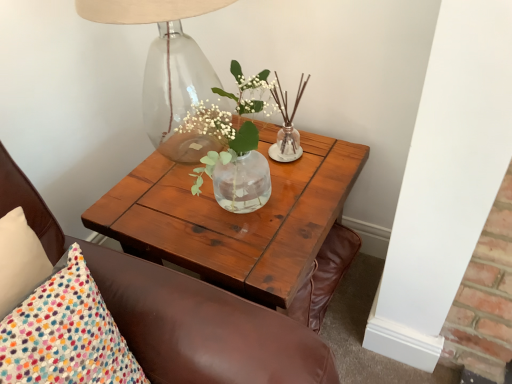
Question: Looking at their shapes, would you say brown leather chair at upper left is wider or thinner than wooden coffee table at center?

Choices:
 (A) wide
 (B) thin

Answer: (B)

Question: In the image, is brown leather chair at upper left on the left side or the right side of wooden coffee table at center?

Choices:
 (A) left
 (B) right

Answer: (A)

Question: Which of these objects is positioned farthest from the brown leather chair at upper left?

Choices:
 (A) wooden coffee table at center
 (B) transparent glass table lamp at upper left

Answer: (B)

Question: Considering the real-world distances, which object is farthest from the wooden coffee table at center?

Choices:
 (A) transparent glass table lamp at upper left
 (B) brown leather chair at upper left

Answer: (A)